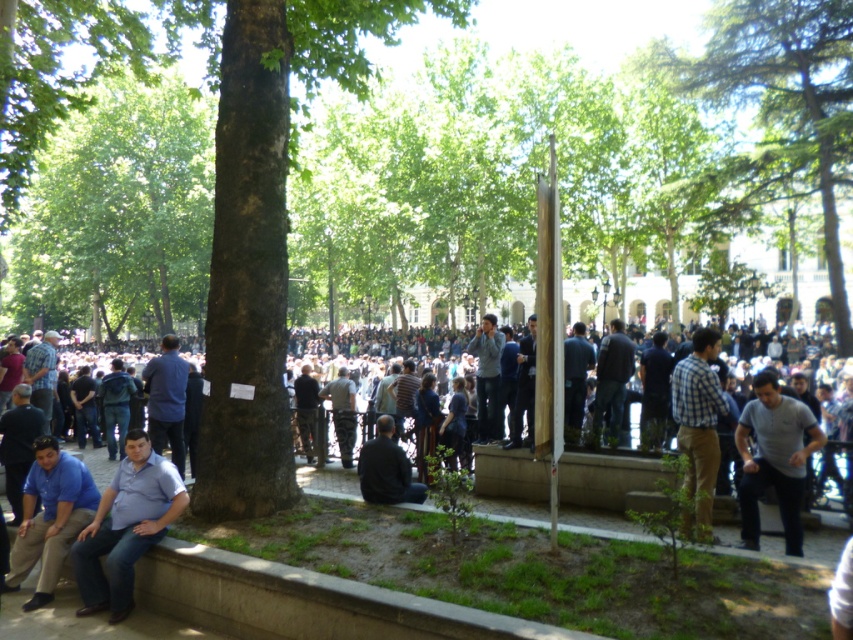
You are standing in the park and want to take a photo of the gray cotton shirt at lower right. To avoid blocking the green textured tree at upper right in your shot, which direction should you move?

You should move to the left to avoid blocking the green textured tree at upper right, as it is to the right of the gray cotton shirt at lower right.

You are a photographer trying to capture a clear shot of the green textured tree at upper right and the gray cotton shirt at lower right. Since you want both subjects to be in focus, you need to adjust your camera settings. Considering their sizes, which subject should you focus on first to ensure depth of field?

The green textured tree at upper right might be wider than gray cotton shirt at lower right, so focusing on the larger subject first would help maintain depth of field for both.